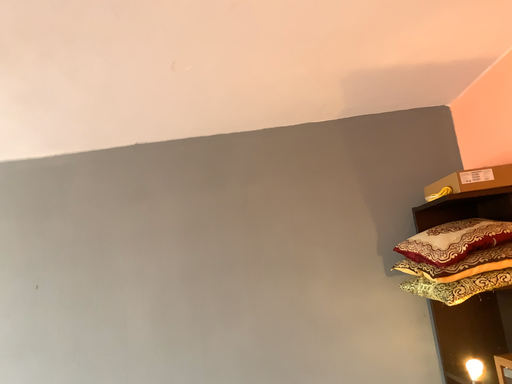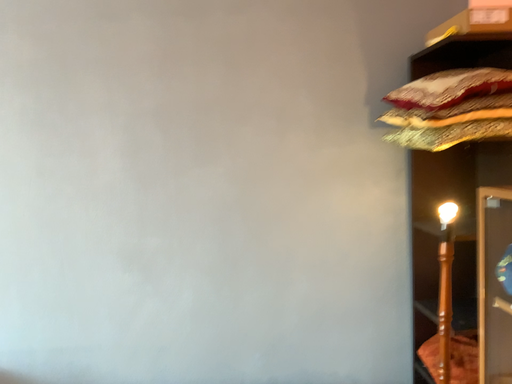
Question: Which way did the camera rotate in the video?

Choices:
 (A) rotated upward
 (B) rotated downward

Answer: (B)